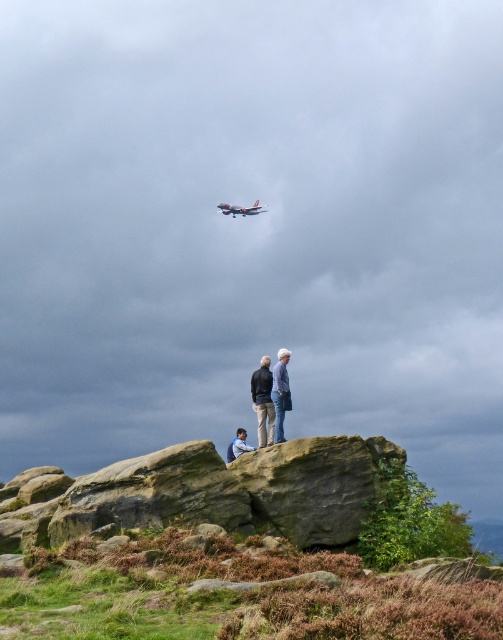
You are trying to locate the light blue denim jeans at center in the image. According to the coordinates provided, where exactly is it positioned?

The light blue denim jeans at center is located at point coordinates of 0.623 on the x axis and 0.539 on the y axis.

You are trying to decide whether to wear the light blue denim jacket at center over your light blue denim jeans at center for a hike. Based on the scene, is the jacket currently positioned in a way that it could be easily put on without needing to remove the jeans?

The light blue denim jeans at center is located below light blue denim jacket at center, so the jacket is positioned over the jeans. This means you can put on the jacket over the jeans without needing to remove them.